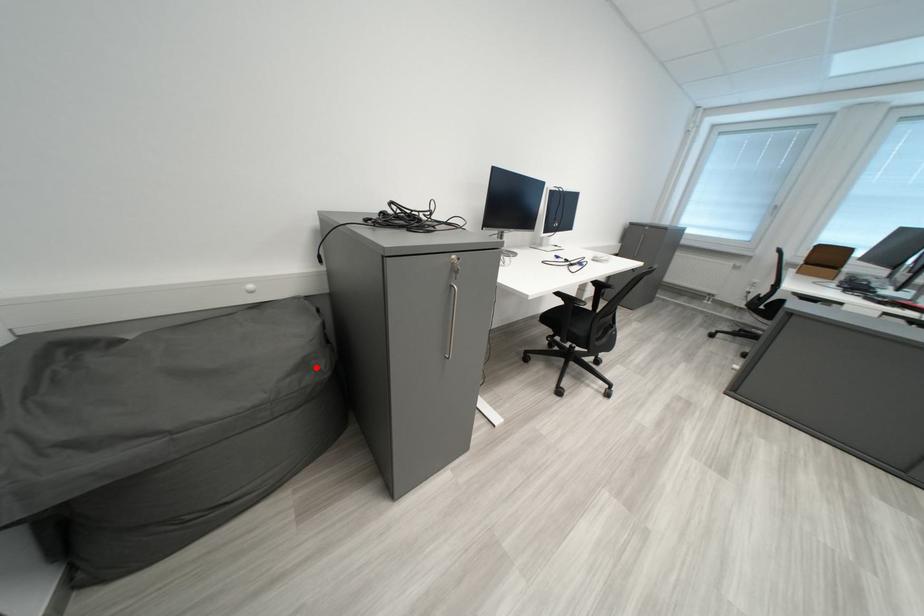
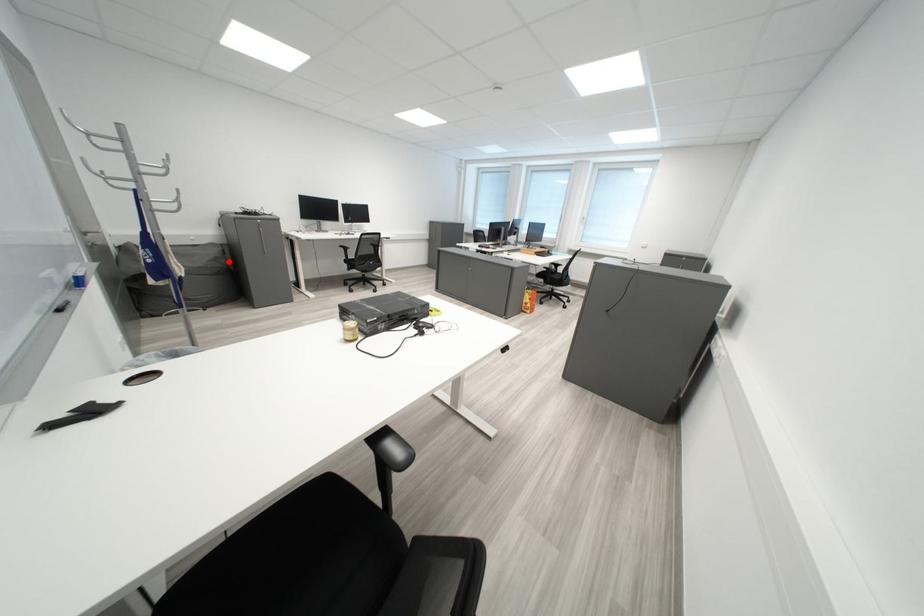
I am providing you with two images of the same scene from different viewpoints. A red point is marked on the first image and another point is marked on the second image. Does the point marked in image1 correspond to the same location as the one in image2?

Yes